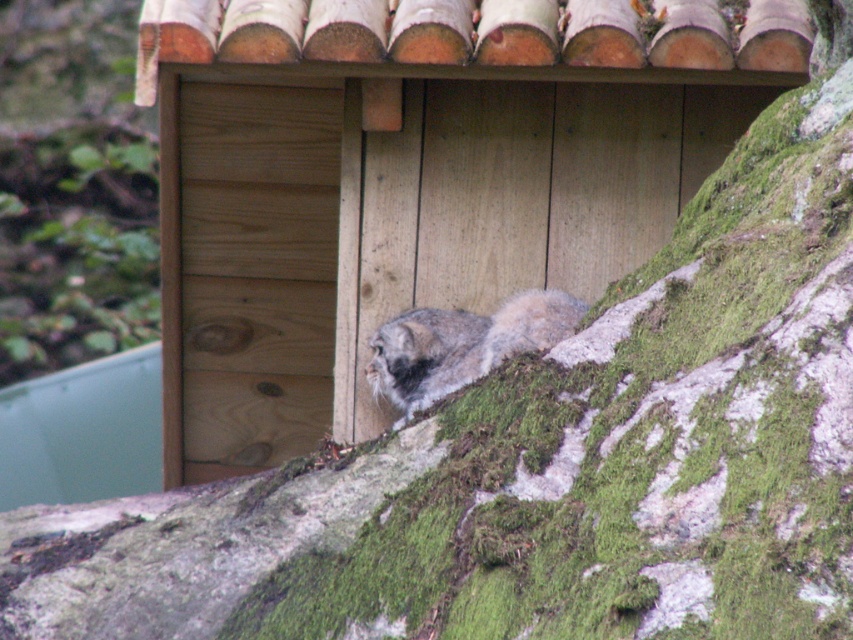
This screenshot has height=640, width=853. In order to click on wooden cabin at center in this screenshot , I will do `click(422, 193)`.

Is wooden cabin at center in front of fuzzy gray cat at center?

Yes.

Which is in front, point (554, 65) or point (465, 317)?

Point (554, 65)

Find the location of `wooden cabin at center`. wooden cabin at center is located at coordinates (422, 193).